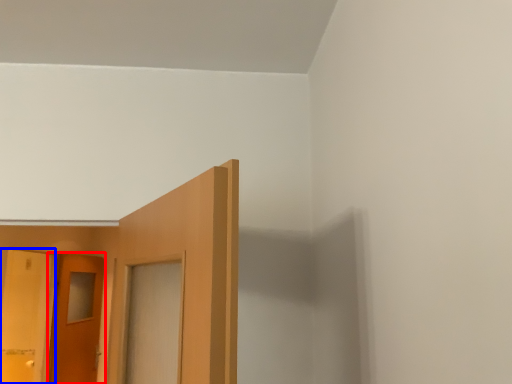
Question: Which point is further to the camera, door (highlighted by a red box) or door (highlighted by a blue box)?

Choices:
 (A) door
 (B) door

Answer: (A)